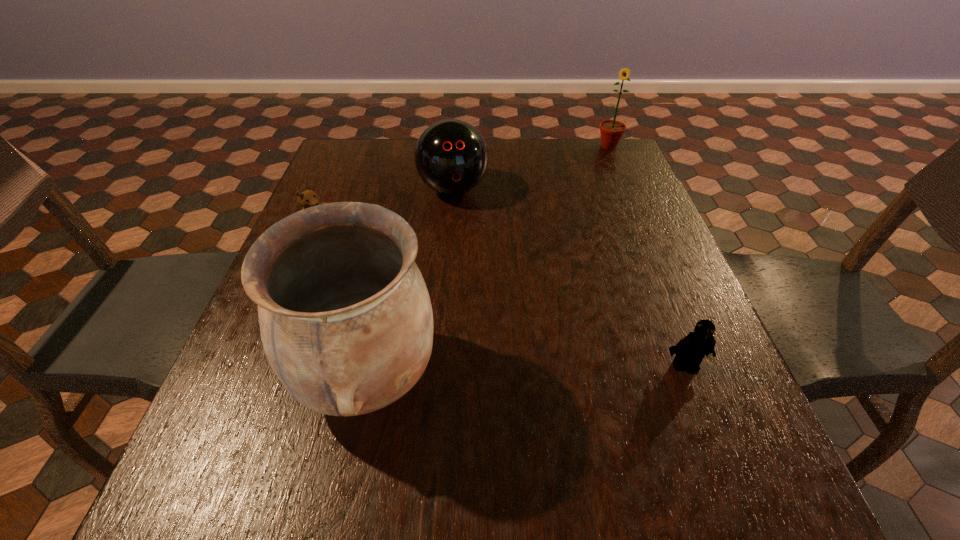
Locate an element on the screen. vacant space on the desktop that is between the tallest object and the Lego and is positioned on the surface of the fourth nearest object near the finger holes is located at coordinates (495, 372).

What are the coordinates of `free space on the desktop that is between the urn and the Lego and is positioned on the front-facing side of the teddy bear` in the screenshot? It's located at (554, 369).

I want to click on free space on the desktop that is between the tallest object and the Lego and is positioned on the face of the sunflower, so click(x=546, y=369).